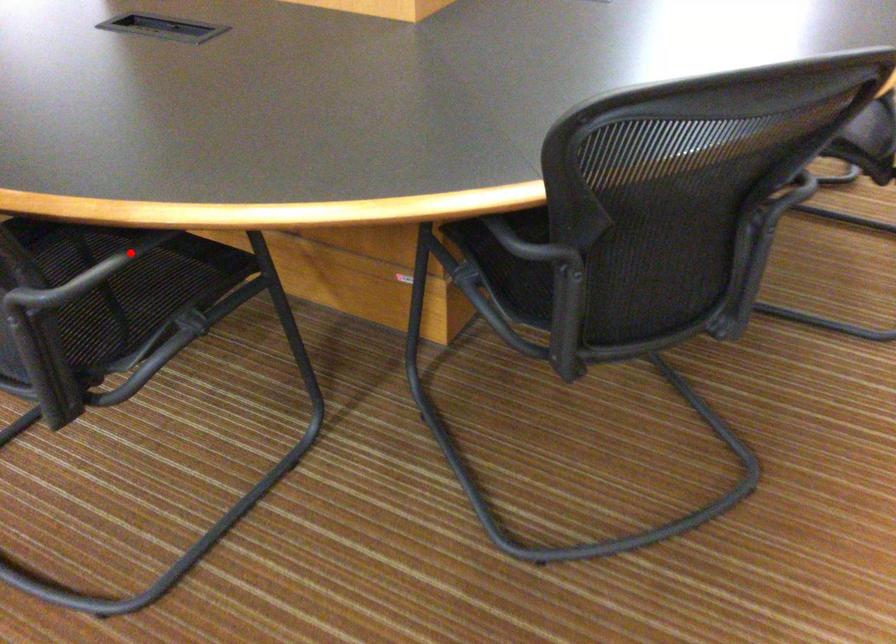
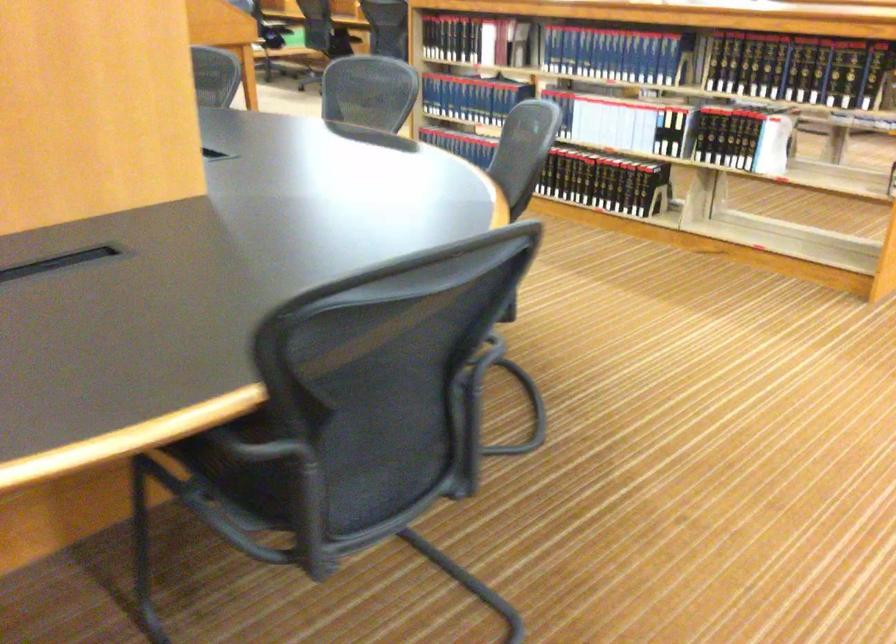
Question: I am providing you with two images of the same scene from different viewpoints. A red point is marked on the first image. Is the red point's position out of view in image 2?

Choices:
 (A) Yes
 (B) No

Answer: (A)